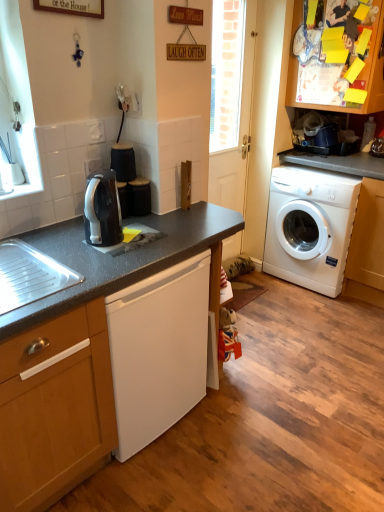
Question: Is wooden cabinet at lower left, positioned as the second cabinetry in right-to-left order, closer to camera compared to white plastic washing machine at right?

Choices:
 (A) no
 (B) yes

Answer: (B)

Question: From the image's perspective, is wooden cabinet at lower left, which is the first cabinetry from bottom to top, over white plastic washing machine at right?

Choices:
 (A) yes
 (B) no

Answer: (B)

Question: Is wooden cabinet at lower left, which is the second cabinetry from top to bottom, shorter than white plastic washing machine at right?

Choices:
 (A) no
 (B) yes

Answer: (A)

Question: Does wooden cabinet at lower left, which is the first cabinetry from bottom to top, appear on the right side of white plastic washing machine at right?

Choices:
 (A) yes
 (B) no

Answer: (B)

Question: Is wooden cabinet at lower left, marked as the 2th cabinetry in a back-to-front arrangement, oriented away from white plastic washing machine at right?

Choices:
 (A) yes
 (B) no

Answer: (B)

Question: Considering the positions of black granite countertop at center and yellow paper at upper right, arranged as the 1th cabinetry when viewed from the back, in the image, is black granite countertop at center bigger or smaller than yellow paper at upper right, arranged as the 1th cabinetry when viewed from the back,?

Choices:
 (A) small
 (B) big

Answer: (B)

Question: Considering the positions of point (87, 380) and point (365, 97), is point (87, 380) closer or farther from the camera than point (365, 97)?

Choices:
 (A) closer
 (B) farther

Answer: (A)

Question: Is black granite countertop at center in front of or behind yellow paper at upper right, the second cabinetry positioned from the left, in the image?

Choices:
 (A) front
 (B) behind

Answer: (A)

Question: Is black granite countertop at center wider or thinner than yellow paper at upper right, which is the first cabinetry from top to bottom?

Choices:
 (A) thin
 (B) wide

Answer: (B)

Question: Based on their sizes in the image, would you say white glossy door at center is bigger or smaller than yellow paper at upper right, which is the first cabinetry from top to bottom?

Choices:
 (A) big
 (B) small

Answer: (B)

Question: Choose the correct answer: Is white glossy door at center inside yellow paper at upper right, which is the first cabinetry from top to bottom, or outside it?

Choices:
 (A) inside
 (B) outside

Answer: (B)

Question: From a real-world perspective, relative to yellow paper at upper right, marked as the 2th cabinetry in a bottom-to-top arrangement, is white glossy door at center vertically above or below?

Choices:
 (A) above
 (B) below

Answer: (B)

Question: From the image's perspective, is white glossy door at center above or below yellow paper at upper right, marked as the 2th cabinetry in a bottom-to-top arrangement?

Choices:
 (A) above
 (B) below

Answer: (B)

Question: Considering the positions of black glossy kettle at upper left and wooden cabinet at lower left, the first cabinetry in the front-to-back sequence, in the image, is black glossy kettle at upper left bigger or smaller than wooden cabinet at lower left, the first cabinetry in the front-to-back sequence,?

Choices:
 (A) small
 (B) big

Answer: (A)

Question: In the image, is black glossy kettle at upper left positioned in front of or behind wooden cabinet at lower left, which is the second cabinetry from top to bottom?

Choices:
 (A) front
 (B) behind

Answer: (B)